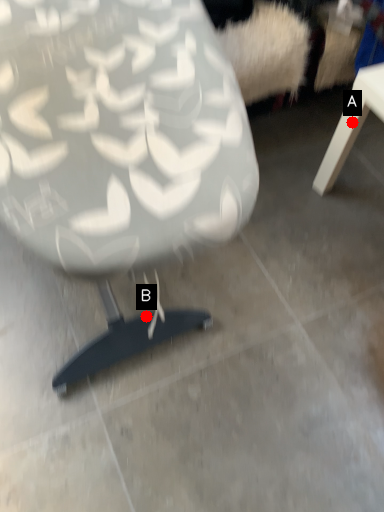
Question: Two points are circled on the image, labeled by A and B beside each circle. Which point is farther to the camera?

Choices:
 (A) A is further
 (B) B is further

Answer: (A)